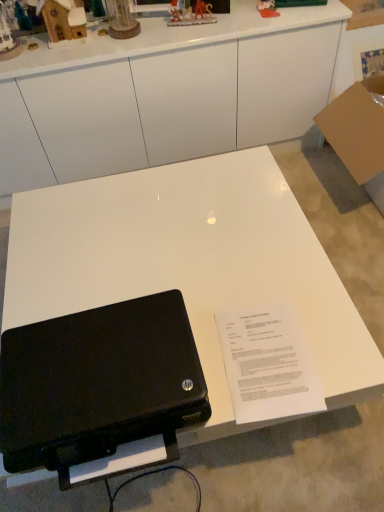
Identify the location of free point to the right of plastic toy at upper center, which ranks as the 1th toy in right-to-left order. (302, 7).